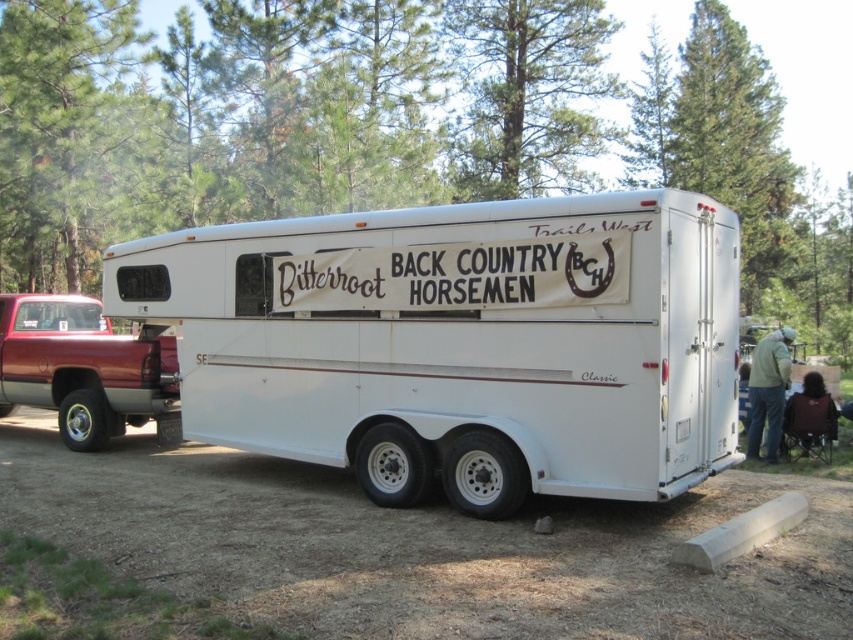
Between green fabric jacket at lower right and dark brown fabric chair at lower right, which one appears on the right side from the viewer's perspective?

dark brown fabric chair at lower right

Can you confirm if green fabric jacket at lower right is bigger than dark brown fabric chair at lower right?

Actually, green fabric jacket at lower right might be smaller than dark brown fabric chair at lower right.

Which is behind, point (761, 380) or point (814, 442)?

The point (814, 442) is behind.

Locate an element on the screen. This screenshot has width=853, height=640. green fabric jacket at lower right is located at coordinates (769, 390).

Can you confirm if white matte horse trailer at center is positioned to the right of shiny maroon truck at left?

Yes, white matte horse trailer at center is to the right of shiny maroon truck at left.

Looking at this image, can you confirm if white matte horse trailer at center is positioned to the left of shiny maroon truck at left?

No, white matte horse trailer at center is not to the left of shiny maroon truck at left.

Where is `white matte horse trailer at center`? This screenshot has width=853, height=640. white matte horse trailer at center is located at coordinates (460, 342).

Is point (96, 397) positioned before point (767, 442)?

Yes, it is.

Between shiny maroon truck at left and green fabric jacket at lower right, which one has more height?

shiny maroon truck at left

Is point (44, 300) farther from viewer compared to point (772, 342)?

Yes, point (44, 300) is farther from viewer.

This screenshot has height=640, width=853. I want to click on shiny maroon truck at left, so click(84, 369).